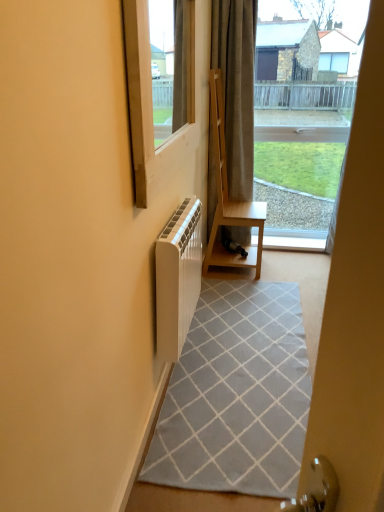
Question: Can you confirm if transparent glass window at center is wider than dark gray textured curtain at center?

Choices:
 (A) yes
 (B) no

Answer: (B)

Question: Is transparent glass window at center surrounding dark gray textured curtain at center?

Choices:
 (A) no
 (B) yes

Answer: (A)

Question: Is transparent glass window at center in front of dark gray textured curtain at center?

Choices:
 (A) yes
 (B) no

Answer: (B)

Question: Is dark gray textured curtain at center at the back of transparent glass window at center?

Choices:
 (A) no
 (B) yes

Answer: (A)

Question: Considering the relative sizes of transparent glass window at center and dark gray textured curtain at center in the image provided, is transparent glass window at center thinner than dark gray textured curtain at center?

Choices:
 (A) no
 (B) yes

Answer: (B)

Question: From the image's perspective, is transparent glass window at center below dark gray textured curtain at center?

Choices:
 (A) yes
 (B) no

Answer: (A)

Question: Can you confirm if white wood at center is positioned to the right of white plastic window at upper left?

Choices:
 (A) no
 (B) yes

Answer: (B)

Question: Is white wood at center to the left of white plastic window at upper left from the viewer's perspective?

Choices:
 (A) no
 (B) yes

Answer: (A)

Question: Is the surface of white wood at center in direct contact with white plastic window at upper left?

Choices:
 (A) yes
 (B) no

Answer: (B)

Question: Considering the relative positions of white wood at center and white plastic window at upper left in the image provided, is white wood at center behind white plastic window at upper left?

Choices:
 (A) yes
 (B) no

Answer: (A)

Question: Is white wood at center oriented towards white plastic window at upper left?

Choices:
 (A) yes
 (B) no

Answer: (B)

Question: Is white wood at center positioned in front of white plastic window at upper left?

Choices:
 (A) yes
 (B) no

Answer: (B)

Question: Can you confirm if light brown wood shelf at center is taller than dark gray textured curtain at center?

Choices:
 (A) yes
 (B) no

Answer: (B)